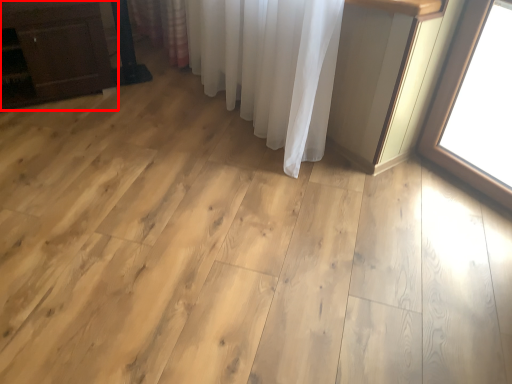
Question: From the image, what is the correct spatial relationship of furniture (annotated by the red box) in relation to curtain?

Choices:
 (A) left
 (B) right

Answer: (A)